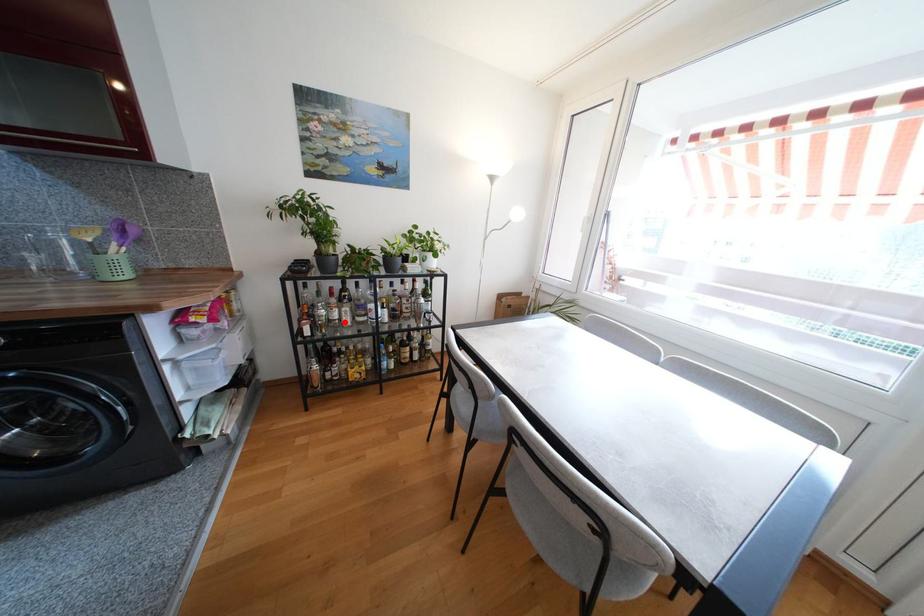
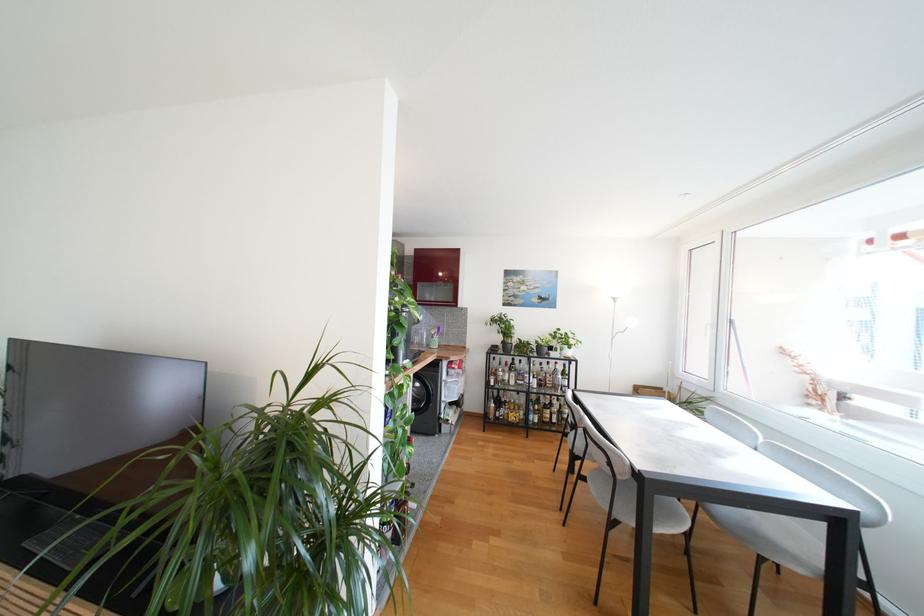
Where in the second image is the point corresponding to the highlighted location from the first image?

(513, 383)